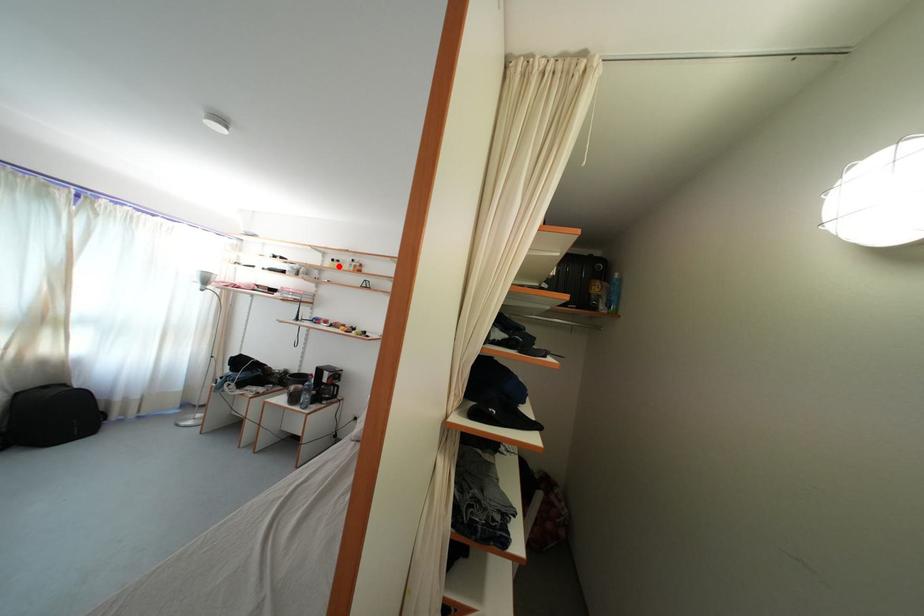
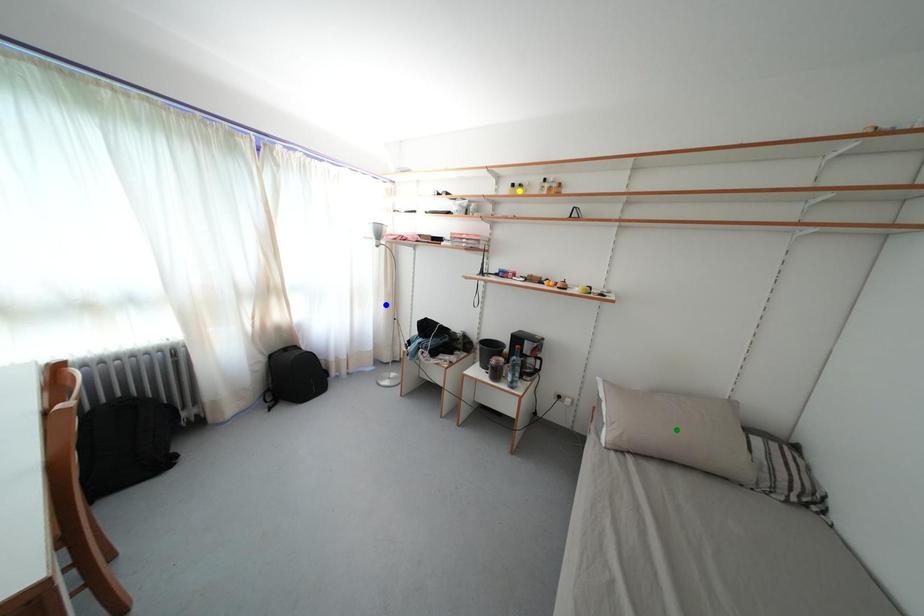
Question: I am providing you with two images of the same scene from different viewpoints. A red point is marked on the first image. You are given multiple points on the second image. Which spot in image 2 lines up with the point in image 1?

Choices:
 (A) yellow point
 (B) blue point
 (C) green point

Answer: (A)